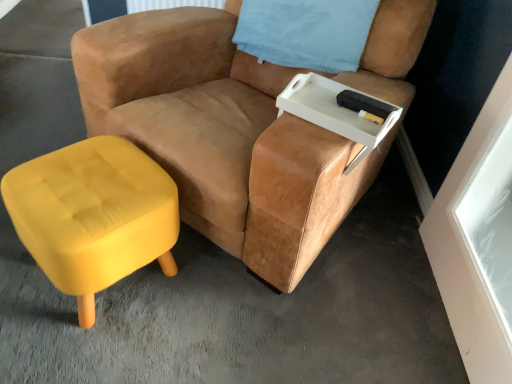
This screenshot has height=384, width=512. Identify the location of blue fabric pillow at upper right. (306, 32).

What do you see at coordinates (332, 111) in the screenshot? I see `white plastic tray at upper right` at bounding box center [332, 111].

This screenshot has width=512, height=384. Identify the location of suede tan chair at center. (241, 125).

What do you see at coordinates (241, 125) in the screenshot? The height and width of the screenshot is (384, 512). I see `suede tan chair at center` at bounding box center [241, 125].

Locate an element on the screen. The height and width of the screenshot is (384, 512). blue fabric pillow at upper right is located at coordinates (306, 32).

Which object is closer to the camera taking this photo, suede tan chair at center or white plastic tray at upper right?

Positioned in front is suede tan chair at center.

In the scene shown: From the image's perspective, is suede tan chair at center located above white plastic tray at upper right?

Yes, from the image's perspective, suede tan chair at center is over white plastic tray at upper right.

Is point (225, 104) positioned after point (313, 111)?

Yes, point (225, 104) is farther from viewer.

Would you say suede tan chair at center is to the left or to the right of white plastic tray at upper right in the picture?

suede tan chair at center is to the left of white plastic tray at upper right.

Could you tell me if white plastic tray at upper right is facing velvet yellow ottoman at lower left?

No, white plastic tray at upper right is not aimed at velvet yellow ottoman at lower left.

Can you tell me how much white plastic tray at upper right and velvet yellow ottoman at lower left differ in facing direction?

The facing directions of white plastic tray at upper right and velvet yellow ottoman at lower left are 10.3 degrees apart.

From a real-world perspective, is white plastic tray at upper right above or below velvet yellow ottoman at lower left?

white plastic tray at upper right is situated higher than velvet yellow ottoman at lower left in the real world.

Considering the sizes of blue fabric pillow at upper right and velvet yellow ottoman at lower left in the image, is blue fabric pillow at upper right bigger or smaller than velvet yellow ottoman at lower left?

Considering their sizes, blue fabric pillow at upper right takes up more space than velvet yellow ottoman at lower left.

Consider the image. How many degrees apart are the facing directions of blue fabric pillow at upper right and velvet yellow ottoman at lower left?

The angular difference between blue fabric pillow at upper right and velvet yellow ottoman at lower left is 6.76 degrees.

Considering the relative positions of blue fabric pillow at upper right and velvet yellow ottoman at lower left in the image provided, is blue fabric pillow at upper right to the right of velvet yellow ottoman at lower left from the viewer's perspective?

Yes.

Looking at this image, is velvet yellow ottoman at lower left surrounded by blue fabric pillow at upper right?

No, velvet yellow ottoman at lower left is located outside of blue fabric pillow at upper right.

From a real-world perspective, is blue fabric pillow at upper right located higher than suede tan chair at center?

Yes, from a real-world perspective, blue fabric pillow at upper right is on top of suede tan chair at center.

Is blue fabric pillow at upper right with suede tan chair at center?

No, blue fabric pillow at upper right is not in contact with suede tan chair at center.

Between blue fabric pillow at upper right and suede tan chair at center, which one has larger width?

Wider between the two is suede tan chair at center.

Does point (263, 50) appear closer or farther from the camera than point (289, 127)?

Point (263, 50).

Choose the correct answer: Is velvet yellow ottoman at lower left inside white plastic tray at upper right or outside it?

velvet yellow ottoman at lower left is spatially situated outside white plastic tray at upper right.

Measure the distance from velvet yellow ottoman at lower left to white plastic tray at upper right.

velvet yellow ottoman at lower left and white plastic tray at upper right are 23.07 inches apart.

Which is more to the right, velvet yellow ottoman at lower left or white plastic tray at upper right?

white plastic tray at upper right.

Is velvet yellow ottoman at lower left inside the boundaries of blue fabric pillow at upper right, or outside?

velvet yellow ottoman at lower left is not inside blue fabric pillow at upper right, it's outside.

Is velvet yellow ottoman at lower left in contact with blue fabric pillow at upper right?

There is a gap between velvet yellow ottoman at lower left and blue fabric pillow at upper right.

Which object is thinner, velvet yellow ottoman at lower left or blue fabric pillow at upper right?

Thinner between the two is velvet yellow ottoman at lower left.

Between point (155, 247) and point (301, 17), which one is positioned in front?

Positioned in front is point (155, 247).

Could you tell me if velvet yellow ottoman at lower left is turned towards suede tan chair at center?

No, velvet yellow ottoman at lower left is not turned towards suede tan chair at center.

Is point (126, 233) positioned behind point (307, 199)?

Yes, it is behind point (307, 199).

Could suede tan chair at center be considered to be inside velvet yellow ottoman at lower left?

Actually, suede tan chair at center is outside velvet yellow ottoman at lower left.

Is velvet yellow ottoman at lower left smaller than suede tan chair at center?

Yes.

The width and height of the screenshot is (512, 384). Find the location of `chair on the left of white plastic tray at upper right`. chair on the left of white plastic tray at upper right is located at coordinates (241, 125).

The image size is (512, 384). I want to click on side table that is behind the velvet yellow ottoman at lower left, so click(x=332, y=111).

When comparing their distances from velvet yellow ottoman at lower left, does white plastic tray at upper right or blue fabric pillow at upper right seem further?

Among the two, blue fabric pillow at upper right is located further to velvet yellow ottoman at lower left.

Estimate the real-world distances between objects in this image. Which object is further from suede tan chair at center, white plastic tray at upper right or blue fabric pillow at upper right?

blue fabric pillow at upper right is positioned further to the anchor suede tan chair at center.

From the image, which object appears to be farther from suede tan chair at center, velvet yellow ottoman at lower left or blue fabric pillow at upper right?

Based on the image, velvet yellow ottoman at lower left appears to be further to suede tan chair at center.

Looking at the image, which one is located closer to white plastic tray at upper right, suede tan chair at center or blue fabric pillow at upper right?

suede tan chair at center is closer to white plastic tray at upper right.

From the image, which object appears to be farther from suede tan chair at center, blue fabric pillow at upper right or velvet yellow ottoman at lower left?

The object further to suede tan chair at center is velvet yellow ottoman at lower left.

In the scene shown: Considering their positions, is suede tan chair at center positioned further to velvet yellow ottoman at lower left than white plastic tray at upper right?

Based on the image, white plastic tray at upper right appears to be further to velvet yellow ottoman at lower left.

When comparing their distances from blue fabric pillow at upper right, does velvet yellow ottoman at lower left or white plastic tray at upper right seem further?

velvet yellow ottoman at lower left is further to blue fabric pillow at upper right.

When comparing their distances from velvet yellow ottoman at lower left, does white plastic tray at upper right or suede tan chair at center seem closer?

suede tan chair at center.

Locate an element on the screen. side table between velvet yellow ottoman at lower left and blue fabric pillow at upper right is located at coordinates (332, 111).

Locate an element on the screen. chair between blue fabric pillow at upper right and velvet yellow ottoman at lower left in the up-down direction is located at coordinates [241, 125].

The width and height of the screenshot is (512, 384). I want to click on chair between blue fabric pillow at upper right and white plastic tray at upper right from top to bottom, so click(x=241, y=125).

Identify the location of chair between velvet yellow ottoman at lower left and white plastic tray at upper right in the horizontal direction. (241, 125).